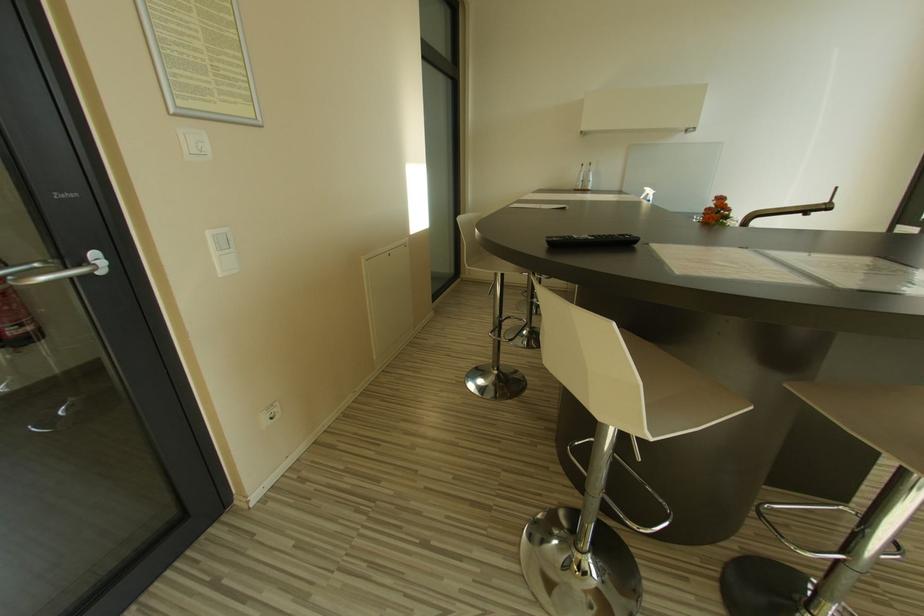
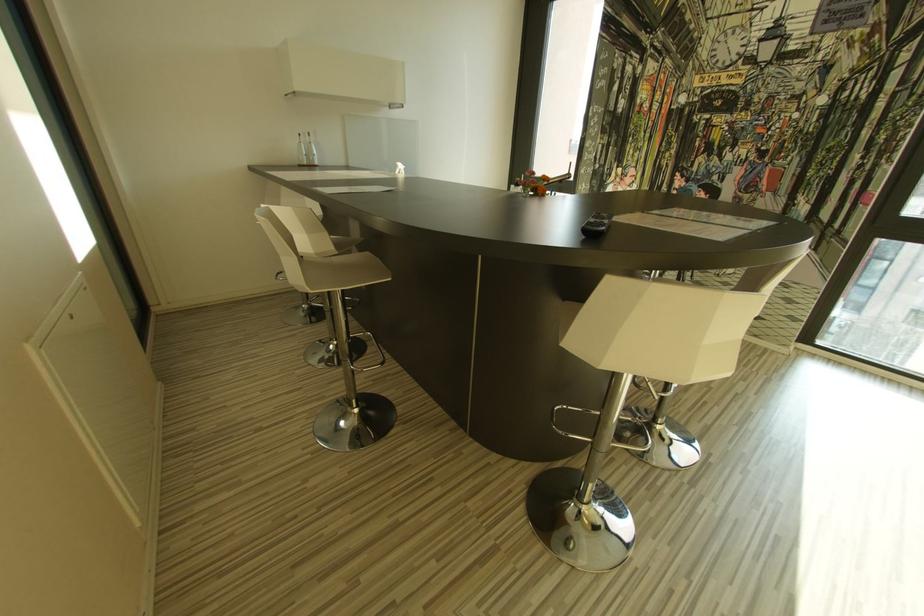
Question: The first image is from the beginning of the video and the second image is from the end. How did the camera likely rotate when shooting the video?

Choices:
 (A) Left
 (B) Right
 (C) Up
 (D) Down

Answer: (B)